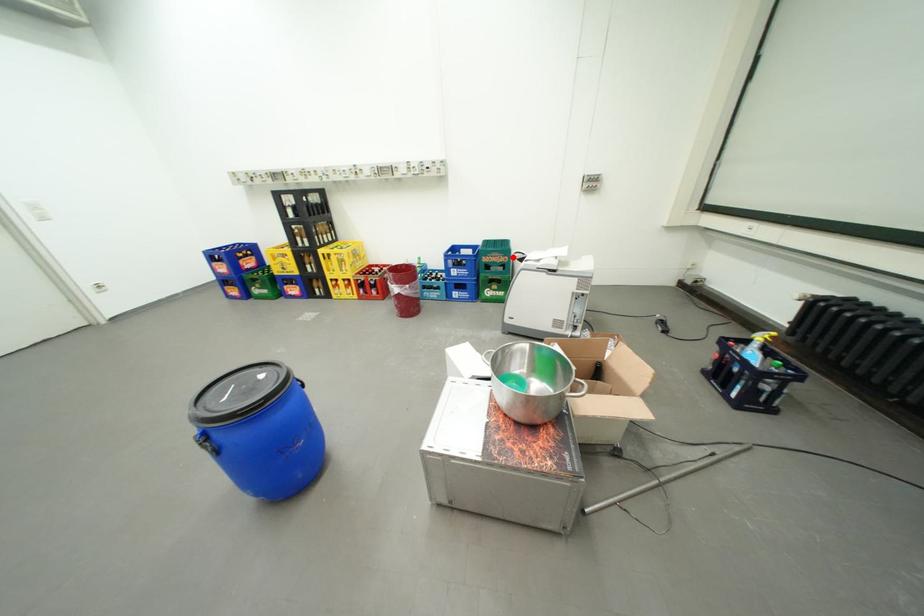
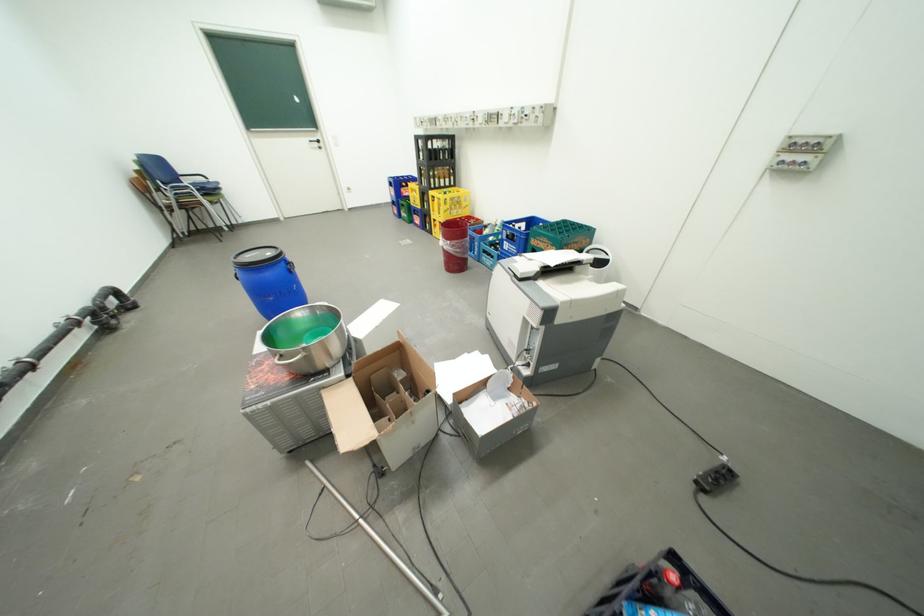
Question: I am providing you with two images of the same scene from different viewpoints. Given a red point in image1, look at the same physical point in image2. Is it:

Choices:
 (A) Closer to the viewpoint
 (B) Farther from the viewpoint

Answer: (B)